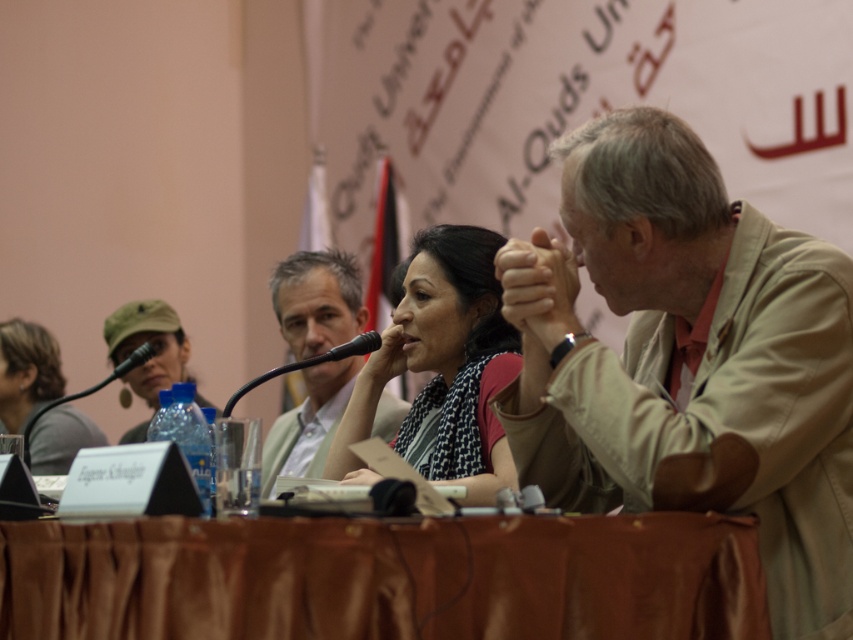
Which is above, brown satin table at center or black plastic microphone at center?

black plastic microphone at center is higher up.

Does point (264, 532) come closer to viewer compared to point (351, 339)?

Yes, it is in front of point (351, 339).

Who is more distant from viewer, (525,614) or (229,403)?

The point (229,403) is more distant.

At what (x,y) coordinates should I click in order to perform the action: click on brown satin table at center. Please return your answer as a coordinate pair (x, y). Looking at the image, I should click on (384, 577).

Between point (450, 237) and point (370, 337), which one is positioned behind?

Point (370, 337)

Is point (485, 499) closer to camera compared to point (305, 368)?

Yes, point (485, 499) is closer to viewer.

Find the location of `matte black scarf at center`. matte black scarf at center is located at coordinates (442, 365).

Who is more forward, (x=778, y=609) or (x=20, y=376)?

Point (x=778, y=609) is in front.

Is tan fabric jacket at center positioned behind matte gray shirt at lower left?

No, tan fabric jacket at center is in front of matte gray shirt at lower left.

Is point (577, 193) positioned before point (32, 429)?

Yes, point (577, 193) is in front of point (32, 429).

Image resolution: width=853 pixels, height=640 pixels. What are the coordinates of `tan fabric jacket at center` in the screenshot? It's located at (688, 353).